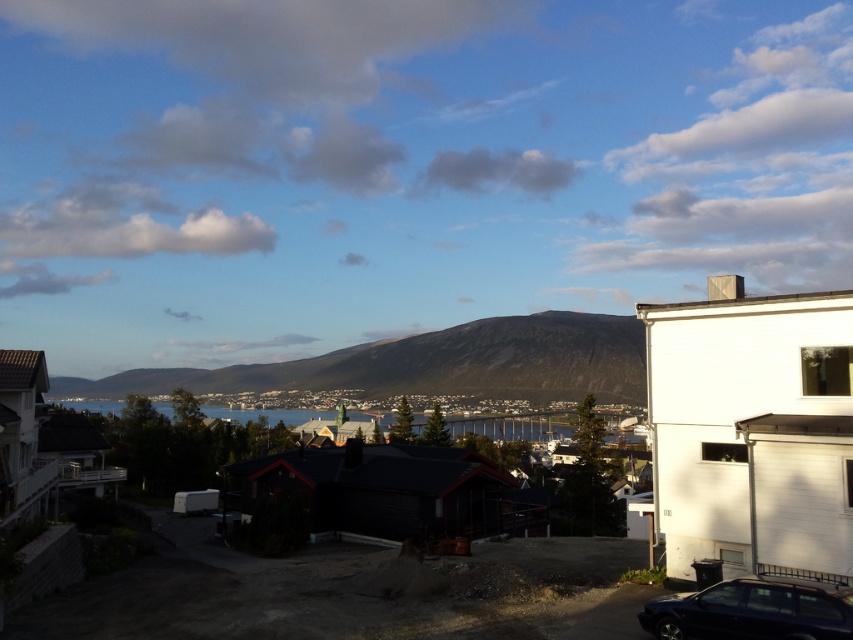
Based on the photo, between shiny black car at lower right and blue water at center, which one appears on the left side from the viewer's perspective?

blue water at center

Based on the photo, can you confirm if shiny black car at lower right is shorter than blue water at center?

Yes.

Image resolution: width=853 pixels, height=640 pixels. Describe the element at coordinates (753, 611) in the screenshot. I see `shiny black car at lower right` at that location.

What are the coordinates of `shiny black car at lower right` in the screenshot? It's located at (753, 611).

Does point (554, 323) come behind point (773, 605)?

Yes, point (554, 323) is farther from viewer.

Which is more to the right, dark gray rocky mountain at center or shiny black car at lower right?

Positioned to the right is shiny black car at lower right.

This screenshot has width=853, height=640. In order to click on dark gray rocky mountain at center in this screenshot , I will do `click(433, 364)`.

You are a GUI agent. You are given a task and a screenshot of the screen. Output one action in this format:
    pyautogui.click(x=<x>, y=<y>)
    Task: Click on the dark gray rocky mountain at center
    Image resolution: width=853 pixels, height=640 pixels.
    Given the screenshot: What is the action you would take?
    (x=433, y=364)

Between dark gray rocky mountain at center and blue water at center, which one appears on the right side from the viewer's perspective?

Positioned to the right is dark gray rocky mountain at center.

Does dark gray rocky mountain at center have a greater width compared to blue water at center?

Yes.

Find the location of a particular element. dark gray rocky mountain at center is located at coordinates (433, 364).